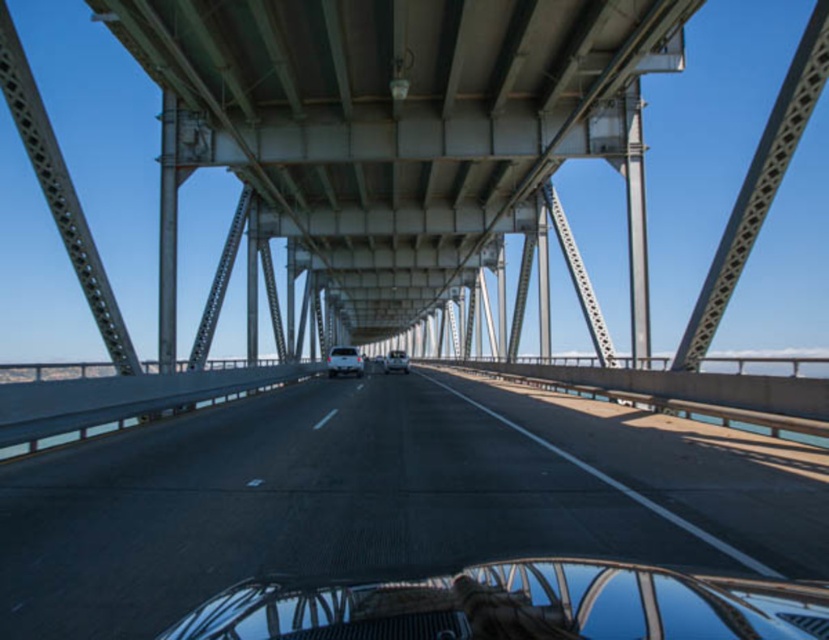
Question: Which object is the farthest from the satin silver sedan at center?

Choices:
 (A) clear glass windshield at center
 (B) white glossy car at center

Answer: (A)

Question: Which object is the farthest from the metallic gray suspension bridge at center?

Choices:
 (A) white glossy car at center
 (B) satin silver sedan at center

Answer: (B)

Question: Which of the following is the farthest from the observer?

Choices:
 (A) white glossy car at center
 (B) clear glass windshield at center
 (C) metallic gray suspension bridge at center

Answer: (A)

Question: Observing the image, what is the correct spatial positioning of smooth asphalt highway at center in reference to metallic gray suspension bridge at center?

Choices:
 (A) below
 (B) above

Answer: (A)

Question: Does white glossy car at center appear over satin silver sedan at center?

Choices:
 (A) yes
 (B) no

Answer: (A)

Question: Can you confirm if clear glass windshield at center is positioned to the right of white glossy car at center?

Choices:
 (A) no
 (B) yes

Answer: (B)